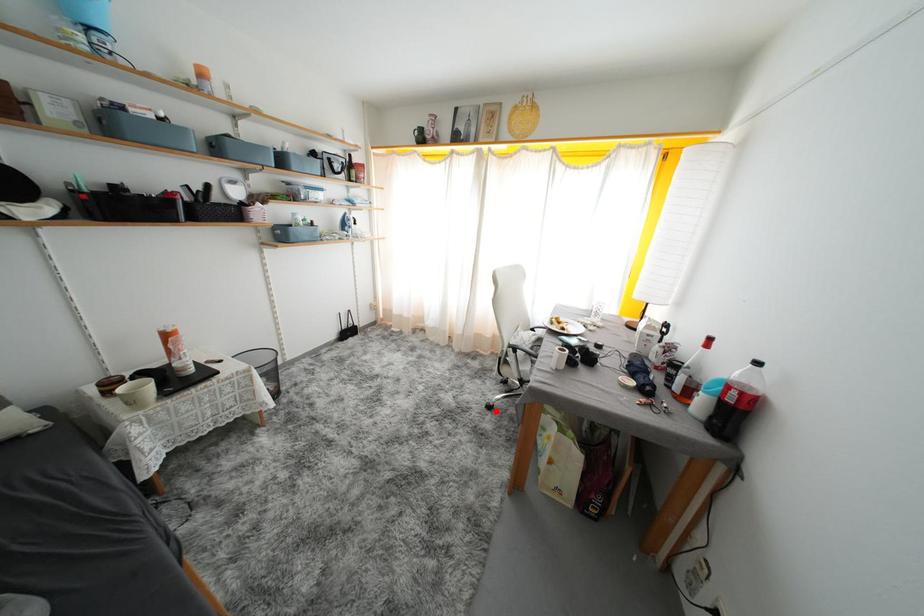
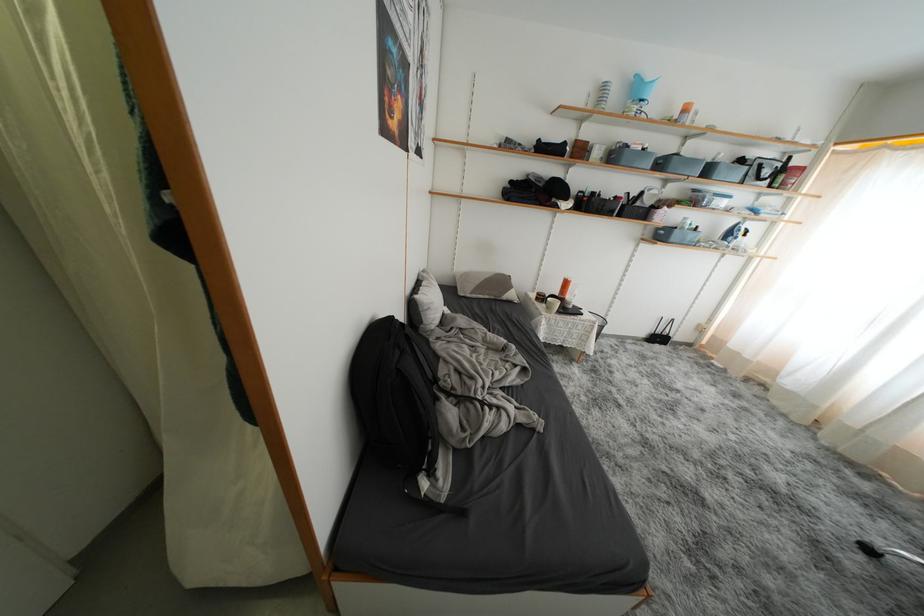
Question: I am providing you with two images of the same scene from different viewpoints. A red point is marked on the first image. At the location where the point appears in image 1, is it still visible in image 2?

Choices:
 (A) Yes
 (B) No

Answer: (A)